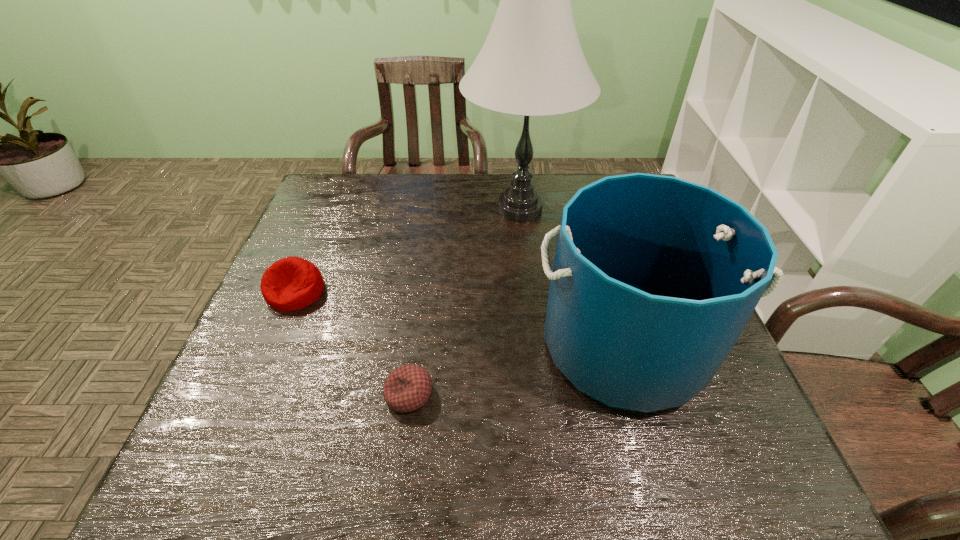
This screenshot has height=540, width=960. I want to click on vacant point located on the back of the nearer beanbag, so click(x=427, y=252).

Find the location of a particular element. Image resolution: width=960 pixels, height=540 pixels. object situated at the far edge is located at coordinates (532, 64).

This screenshot has width=960, height=540. I want to click on object that is at the left edge, so click(292, 283).

Locate an element on the screen. object that is positioned at the right edge is located at coordinates (654, 278).

The height and width of the screenshot is (540, 960). Find the location of `free space at the far edge`. free space at the far edge is located at coordinates (566, 184).

I want to click on free space at the left edge of the desktop, so click(300, 390).

What are the coordinates of `vacant space at the far left corner of the desktop` in the screenshot? It's located at (363, 177).

You are a GUI agent. You are given a task and a screenshot of the screen. Output one action in this format:
    pyautogui.click(x=<x>, y=<y>)
    Task: Click on the empty space between the second tallest object and the third object from right to left
    The width and height of the screenshot is (960, 540).
    Given the screenshot: What is the action you would take?
    pyautogui.click(x=516, y=370)

At what (x,y) coordinates should I click in order to perform the action: click on free point between the shortest object and the farther beanbag. Please return your answer as a coordinate pair (x, y). The image size is (960, 540). Looking at the image, I should click on (352, 343).

Where is `vacant space that's between the second tallest object and the shorter beanbag`? The image size is (960, 540). vacant space that's between the second tallest object and the shorter beanbag is located at coordinates (516, 370).